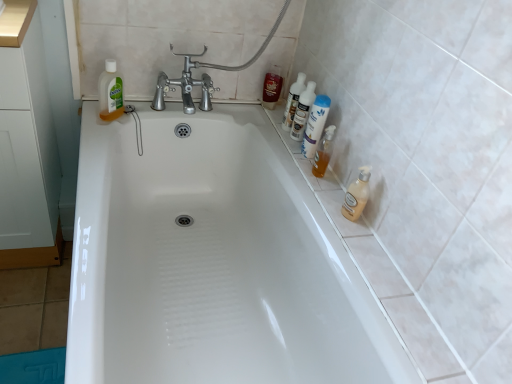
Find the location of a particular element. This screenshot has width=512, height=384. vacant area that is in front of translucent plastic bottle at right, the first toiletry in the bottom-to-top sequence is located at coordinates (336, 205).